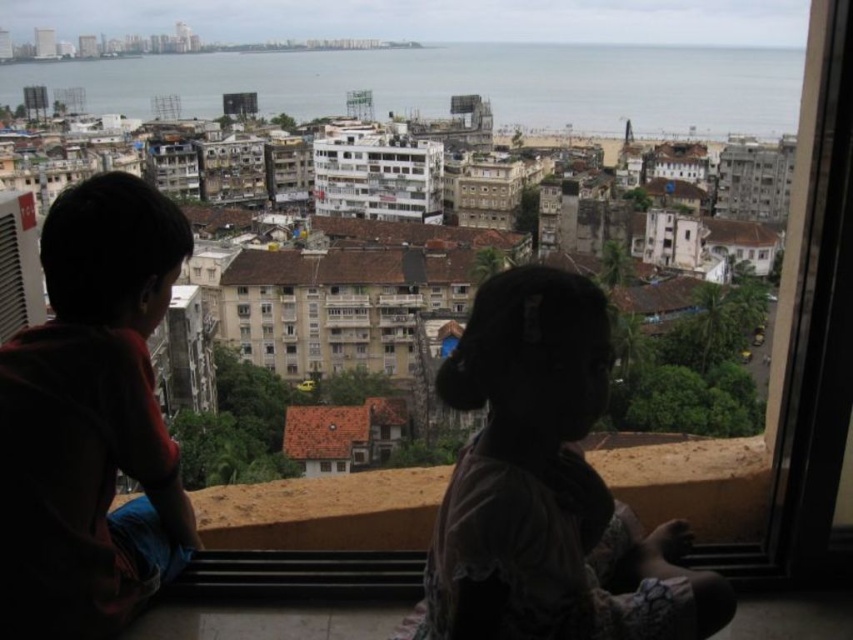
Does dark red t-shirt at left appear over silhouette fabric at center?

Yes.

What do you see at coordinates (91, 420) in the screenshot? I see `dark red t-shirt at left` at bounding box center [91, 420].

Find the location of a particular element. The image size is (853, 640). dark red t-shirt at left is located at coordinates (91, 420).

Is silhouette fabric at center bigger than transparent glass window at center?

Yes.

Does point (508, 300) come in front of point (242, 305)?

That is True.

Is point (525, 470) positioned after point (248, 308)?

That is False.

Locate an element on the screen. This screenshot has height=640, width=853. silhouette fabric at center is located at coordinates (547, 486).

Who is lower down, dark red t-shirt at left or transparent glass window at center?

transparent glass window at center is below.

What do you see at coordinates (91, 420) in the screenshot? Image resolution: width=853 pixels, height=640 pixels. I see `dark red t-shirt at left` at bounding box center [91, 420].

Image resolution: width=853 pixels, height=640 pixels. Find the location of `dark red t-shirt at left`. dark red t-shirt at left is located at coordinates (91, 420).